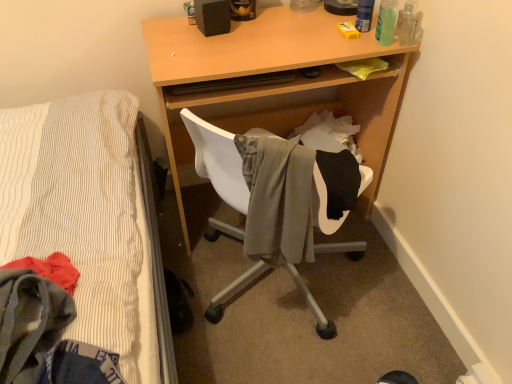
Image resolution: width=512 pixels, height=384 pixels. I want to click on free space that is in between clear plastic bottle at upper right, marked as the 1th bottle in a right-to-left arrangement, and matte black speaker at upper center, so click(x=293, y=33).